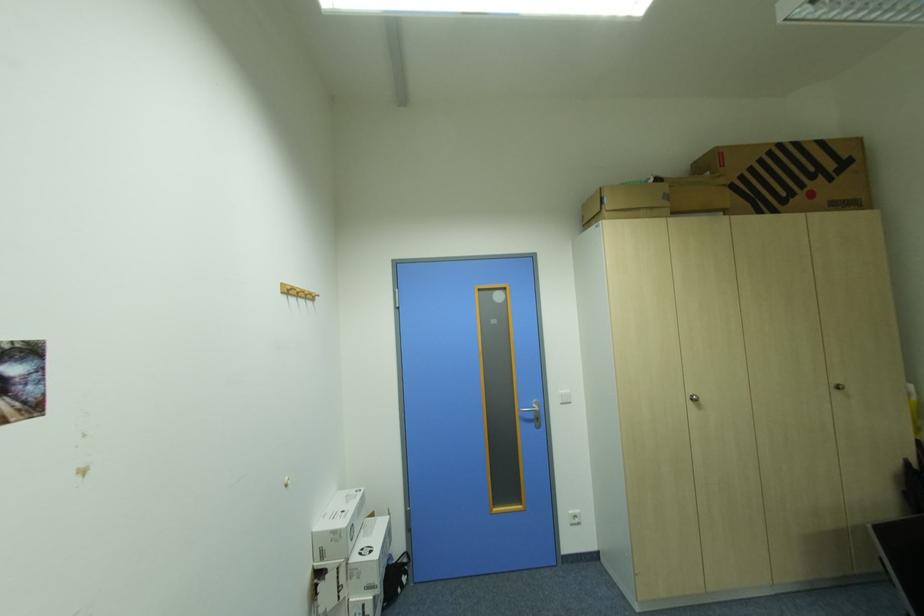
Find where to hang the wooden coat hook. Please return your answer as a coordinate pair (x, y).

(286, 289)